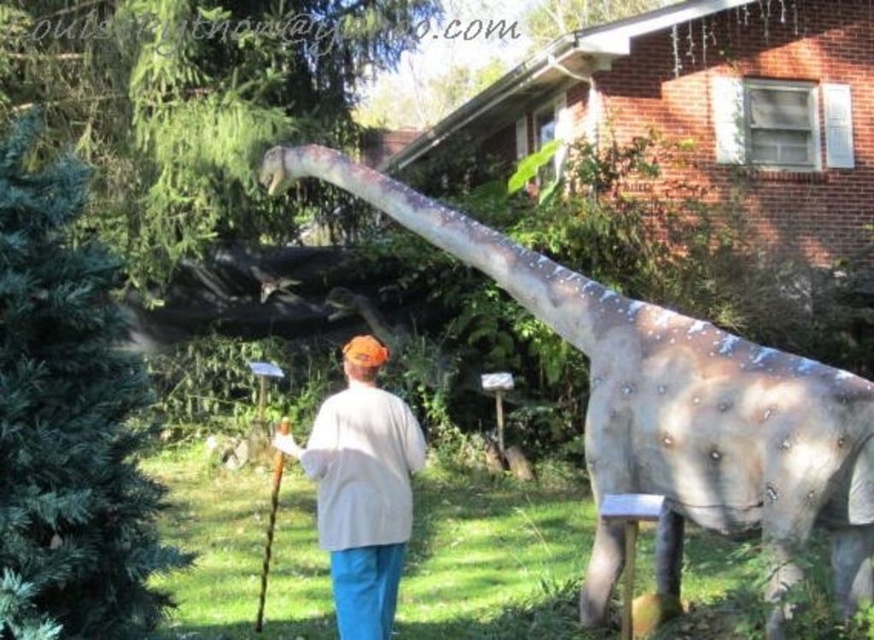
Question: Which point is closer to the camera?

Choices:
 (A) white cotton shirt at center
 (B) speckled gray dinosaur at center
 (C) wooden cane at center

Answer: (B)

Question: Which point is closer to the camera?

Choices:
 (A) speckled gray dinosaur at center
 (B) white cotton shirt at center
 (C) wooden cane at center

Answer: (A)

Question: Which of these objects is positioned closest to the wooden cane at center?

Choices:
 (A) white cotton shirt at center
 (B) speckled gray dinosaur at center

Answer: (A)

Question: Does speckled gray dinosaur at center have a greater width compared to white cotton shirt at center?

Choices:
 (A) yes
 (B) no

Answer: (A)

Question: Does speckled gray dinosaur at center appear under white cotton shirt at center?

Choices:
 (A) no
 (B) yes

Answer: (A)

Question: Is speckled gray dinosaur at center thinner than white cotton shirt at center?

Choices:
 (A) yes
 (B) no

Answer: (B)